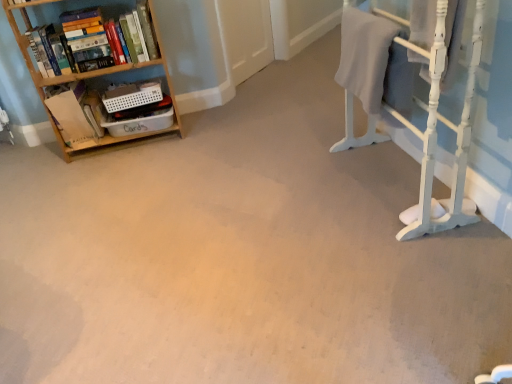
Identify the location of free space in front of wooden bookshelf at left. (122, 178).